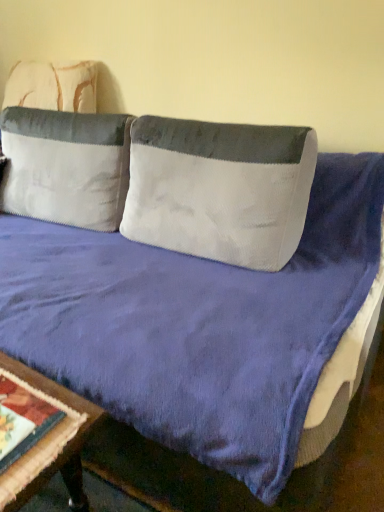
Question: From the image's perspective, does white textured pillow at center, the 2th pillow when ordered from left to right, appear higher than wooden table at lower left?

Choices:
 (A) no
 (B) yes

Answer: (B)

Question: From a real-world perspective, does white textured pillow at center, the 2th pillow when ordered from left to right, stand above wooden table at lower left?

Choices:
 (A) yes
 (B) no

Answer: (A)

Question: Is white textured pillow at center, arranged as the 1th pillow when viewed from the right, in contact with wooden table at lower left?

Choices:
 (A) no
 (B) yes

Answer: (A)

Question: Is white textured pillow at center, the 2th pillow when ordered from left to right, outside wooden table at lower left?

Choices:
 (A) yes
 (B) no

Answer: (A)

Question: Is white textured pillow at center, arranged as the 1th pillow when viewed from the right, positioned behind wooden table at lower left?

Choices:
 (A) no
 (B) yes

Answer: (B)

Question: Is wooden table at lower left surrounded by white textured pillow at center, the 2th pillow when ordered from left to right?

Choices:
 (A) no
 (B) yes

Answer: (A)

Question: Does wooden table at lower left have a greater width compared to white velvety pillow at upper left, which ranks as the 2th pillow in right-to-left order?

Choices:
 (A) yes
 (B) no

Answer: (B)

Question: Does wooden table at lower left come behind white velvety pillow at upper left, which is the 1th pillow from left to right?

Choices:
 (A) yes
 (B) no

Answer: (B)

Question: Can you confirm if wooden table at lower left is taller than white velvety pillow at upper left, which is the 1th pillow from left to right?

Choices:
 (A) yes
 (B) no

Answer: (B)

Question: From the image's perspective, does wooden table at lower left appear higher than white velvety pillow at upper left, which ranks as the 2th pillow in right-to-left order?

Choices:
 (A) no
 (B) yes

Answer: (A)

Question: Is white velvety pillow at upper left, which is the 1th pillow from left to right, inside wooden table at lower left?

Choices:
 (A) no
 (B) yes

Answer: (A)

Question: Are wooden table at lower left and white velvety pillow at upper left, which is the 1th pillow from left to right, located far from each other?

Choices:
 (A) no
 (B) yes

Answer: (A)

Question: Can you confirm if white velvety pillow at upper left, which is the 1th pillow from left to right, is taller than white textured pillow at center, the 2th pillow when ordered from left to right?

Choices:
 (A) yes
 (B) no

Answer: (A)